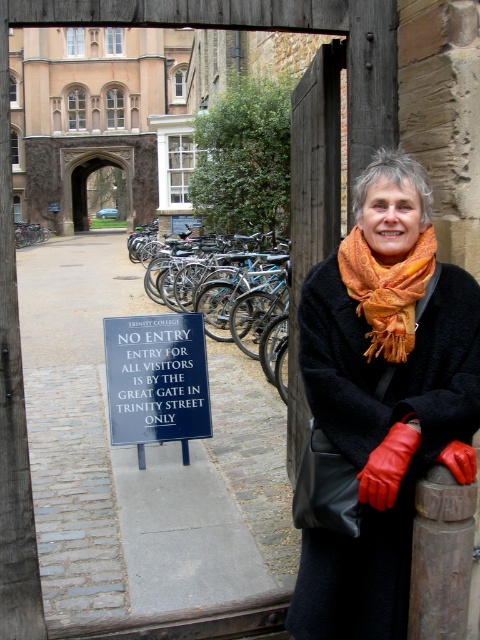
Is orange scarf at upper center smaller than brown wooden post at center?

No, orange scarf at upper center is not smaller than brown wooden post at center.

Is orange scarf at upper center wider than brown wooden post at center?

Correct, the width of orange scarf at upper center exceeds that of brown wooden post at center.

Looking at this image, measure the distance between point (407, 200) and camera.

Point (407, 200) and camera are 3.26 meters apart from each other.

This screenshot has width=480, height=640. I want to click on orange scarf at upper center, so click(383, 396).

Is blue plastic sign at center closer to the viewer compared to blue metallic bicycle at center?

That is True.

Does blue plastic sign at center have a smaller size compared to blue metallic bicycle at center?

No.

Which is behind, point (170, 396) or point (220, 339)?

Point (220, 339)

You are a GUI agent. You are given a task and a screenshot of the screen. Output one action in this format:
    pyautogui.click(x=<x>, y=<y>)
    Task: Click on the blue plastic sign at center
    This screenshot has width=480, height=640.
    Given the screenshot: What is the action you would take?
    pyautogui.click(x=156, y=380)

Is point (361, 237) farther from camera compared to point (368, 282)?

Yes, point (361, 237) is farther from viewer.

Is orange scarf at upper center thinner than orange woven scarf at upper center?

In fact, orange scarf at upper center might be wider than orange woven scarf at upper center.

Identify the location of orange scarf at upper center. (383, 396).

This screenshot has height=640, width=480. I want to click on orange scarf at upper center, so click(383, 396).